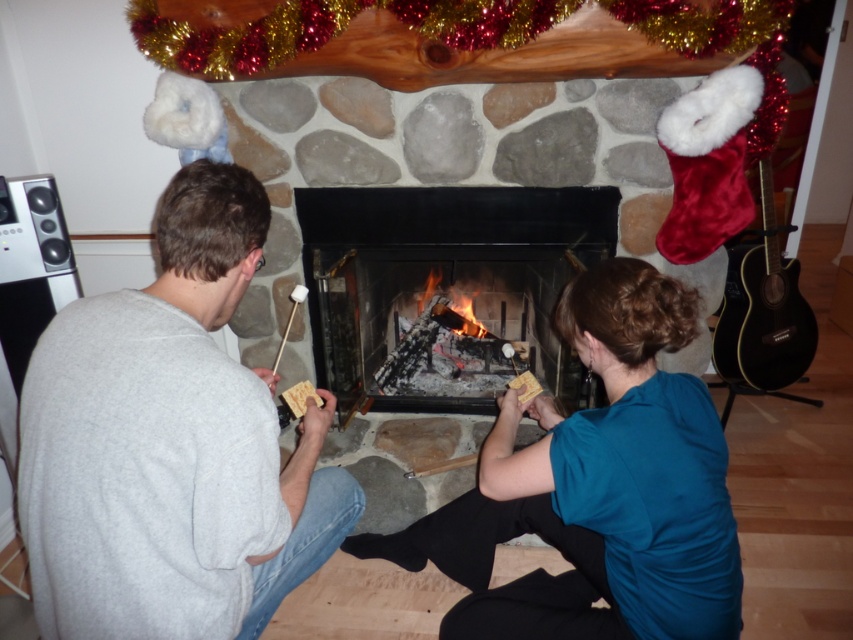
Question: Does teal fabric shirt at center have a greater width compared to black wood guitar at right?

Choices:
 (A) yes
 (B) no

Answer: (A)

Question: Based on their relative distances, which object is farther from the black stone fireplace at center?

Choices:
 (A) black wood guitar at right
 (B) gray cotton shirt at center
 (C) charcoal black wood at center

Answer: (B)

Question: Is gray cotton shirt at center thinner than black wood guitar at right?

Choices:
 (A) yes
 (B) no

Answer: (A)

Question: Which of the following is the closest to the observer?

Choices:
 (A) (554, 419)
 (B) (469, 332)
 (C) (476, 256)

Answer: (A)

Question: Which point appears closest to the camera in this image?

Choices:
 (A) (749, 250)
 (B) (453, 408)
 (C) (38, 474)

Answer: (C)

Question: Does black stone fireplace at center appear on the left side of black wood guitar at right?

Choices:
 (A) no
 (B) yes

Answer: (B)